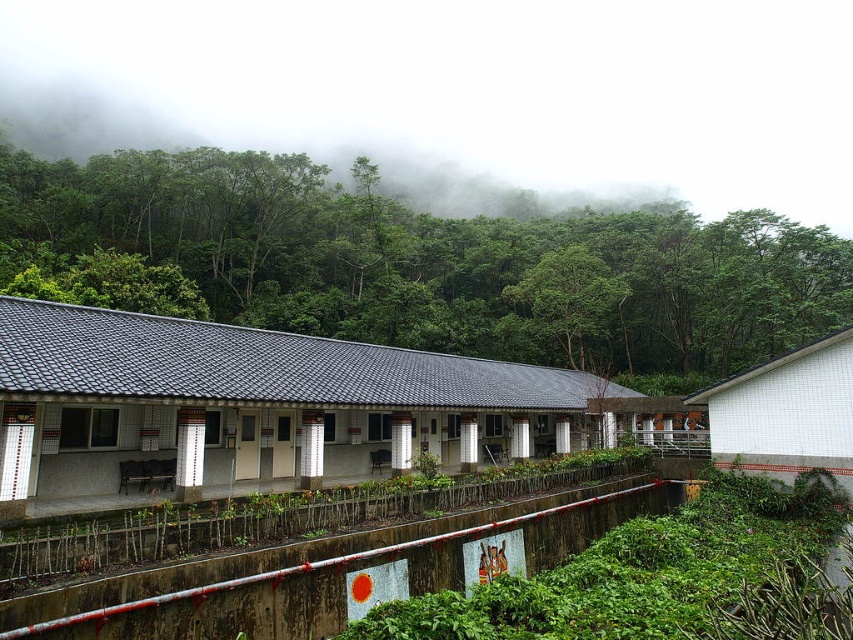
You are standing in front of the traditional building and want to take a photo of both the green leafy trees at upper center and the green leafy tree at center. Which tree should you focus on first if you want to include both in your frame without moving the camera?

You should focus on the green leafy trees at upper center first because it is larger in size than the green leafy tree at center, so capturing its full view will ensure both are included in the frame.

You are standing in front of the traditional building and want to determine the relative positions of two points marked on the ground. The first point is at coordinates point (x=688, y=358) and the second is at point (x=599, y=360). Which point is closer to you?

The point at coordinates point (x=688, y=358) is closer to the viewer than point (x=599, y=360).